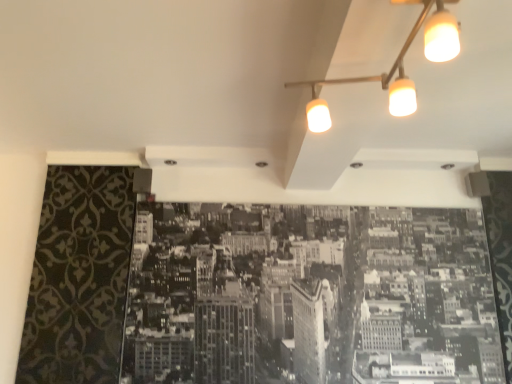
Locate an element on the screen. The image size is (512, 384). matte white track light at upper right is located at coordinates (396, 66).

Describe the element at coordinates (396, 66) in the screenshot. I see `matte white track light at upper right` at that location.

Where is `monochrome paper cityscape at center`? Image resolution: width=512 pixels, height=384 pixels. monochrome paper cityscape at center is located at coordinates (312, 294).

What do you see at coordinates (312, 294) in the screenshot? I see `monochrome paper cityscape at center` at bounding box center [312, 294].

Measure the distance between monochrome paper cityscape at center and camera.

The depth of monochrome paper cityscape at center is 2.18 meters.

Where is `matte white track light at upper right`? matte white track light at upper right is located at coordinates (396, 66).

Based on their positions, is monochrome paper cityscape at center located to the left or right of matte white track light at upper right?

Result: Clearly, monochrome paper cityscape at center is on the left of matte white track light at upper right in the image.

Considering the relative positions of monochrome paper cityscape at center and matte white track light at upper right in the image provided, is monochrome paper cityscape at center in front of matte white track light at upper right?

No, it is behind matte white track light at upper right.

Does point (322, 279) come farther from viewer compared to point (399, 71)?

Yes, it is.

From the image's perspective, who appears lower, monochrome paper cityscape at center or matte white track light at upper right?

monochrome paper cityscape at center.

From a real-world perspective, who is located lower, monochrome paper cityscape at center or matte white track light at upper right?

monochrome paper cityscape at center.

Which of these two, monochrome paper cityscape at center or matte white track light at upper right, is wider?

matte white track light at upper right is wider.

Is monochrome paper cityscape at center shorter than matte white track light at upper right?

No, monochrome paper cityscape at center is not shorter than matte white track light at upper right.

Considering the sizes of monochrome paper cityscape at center and matte white track light at upper right in the image, is monochrome paper cityscape at center bigger or smaller than matte white track light at upper right?

monochrome paper cityscape at center is bigger than matte white track light at upper right.

Can matte white track light at upper right be found inside monochrome paper cityscape at center?

No, matte white track light at upper right is located outside of monochrome paper cityscape at center.

Are monochrome paper cityscape at center and matte white track light at upper right beside each other?

monochrome paper cityscape at center and matte white track light at upper right are clearly separated.

Could you tell me if monochrome paper cityscape at center is facing matte white track light at upper right?

Yes, monochrome paper cityscape at center is turned towards matte white track light at upper right.

At what (x,y) coordinates should I click in order to perform the action: click on hotel that is on the left side of matte white track light at upper right. Please return your answer as a coordinate pair (x, y). The width and height of the screenshot is (512, 384). Looking at the image, I should click on (312, 294).

Can you confirm if matte white track light at upper right is positioned to the right of monochrome paper cityscape at center?

Correct, you'll find matte white track light at upper right to the right of monochrome paper cityscape at center.

Does matte white track light at upper right come in front of monochrome paper cityscape at center?

Yes, matte white track light at upper right is closer to the camera.

Considering the points (313, 93) and (486, 254), which point is in front, point (313, 93) or point (486, 254)?

The point (313, 93) is closer to the camera.

From the image's perspective, would you say matte white track light at upper right is positioned over monochrome paper cityscape at center?

Correct, matte white track light at upper right appears higher than monochrome paper cityscape at center in the image.

From a real-world perspective, which object stands above the other?

matte white track light at upper right, from a real-world perspective.

Which object is thinner, matte white track light at upper right or monochrome paper cityscape at center?

Thinner between the two is monochrome paper cityscape at center.

From their relative heights in the image, would you say matte white track light at upper right is taller or shorter than monochrome paper cityscape at center?

Clearly, matte white track light at upper right is shorter compared to monochrome paper cityscape at center.

Considering the relative sizes of matte white track light at upper right and monochrome paper cityscape at center in the image provided, is matte white track light at upper right smaller than monochrome paper cityscape at center?

Yes.

Is matte white track light at upper right surrounding monochrome paper cityscape at center?

No.

Is matte white track light at upper right placed right next to monochrome paper cityscape at center?

matte white track light at upper right is not next to monochrome paper cityscape at center, and they're not touching.

Does matte white track light at upper right turn towards monochrome paper cityscape at center?

No, matte white track light at upper right is not aimed at monochrome paper cityscape at center.

Can you tell me how much matte white track light at upper right and monochrome paper cityscape at center differ in facing direction?

matte white track light at upper right and monochrome paper cityscape at center are facing 94.1 degrees away from each other.

How distant is matte white track light at upper right from monochrome paper cityscape at center?

The distance of matte white track light at upper right from monochrome paper cityscape at center is 4.72 feet.

Image resolution: width=512 pixels, height=384 pixels. Find the location of `hotel below the matte white track light at upper right (from a real-world perspective)`. hotel below the matte white track light at upper right (from a real-world perspective) is located at coordinates (312, 294).

In order to click on hotel below the matte white track light at upper right (from a real-world perspective) in this screenshot , I will do `click(312, 294)`.

Find the location of a particular element. This screenshot has height=384, width=512. hotel behind the matte white track light at upper right is located at coordinates coord(312,294).